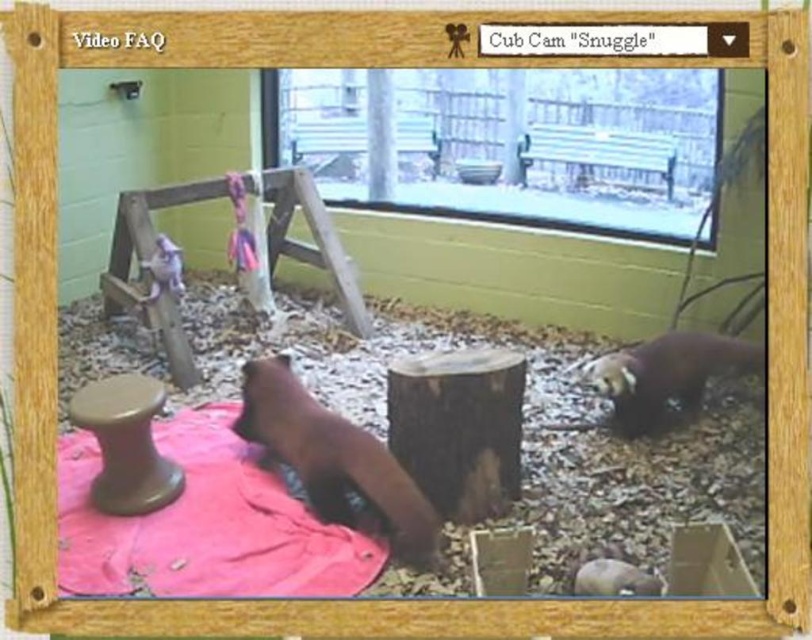
Is pink fabric at lower left bigger than brown furry bear at lower right?

Yes, pink fabric at lower left is bigger than brown furry bear at lower right.

Who is positioned more to the left, pink fabric at lower left or brown furry bear at lower right?

pink fabric at lower left

This screenshot has width=812, height=640. Find the location of `pink fabric at lower left`. pink fabric at lower left is located at coordinates (205, 524).

Based on the photo, who is higher up, pink fabric at lower left or matte brown stool at lower left?

matte brown stool at lower left is above.

Based on the photo, does pink fabric at lower left come in front of matte brown stool at lower left?

Yes, pink fabric at lower left is in front of matte brown stool at lower left.

Between point (309, 524) and point (140, 433), which one is positioned behind?

The point (140, 433) is more distant.

At what (x,y) coordinates should I click in order to perform the action: click on pink fabric at lower left. Please return your answer as a coordinate pair (x, y). Looking at the image, I should click on (205, 524).

Image resolution: width=812 pixels, height=640 pixels. Find the location of `pink fabric at lower left`. pink fabric at lower left is located at coordinates (205, 524).

Which of these two, pink fabric at lower left or brown furry animal at center, stands shorter?

pink fabric at lower left

I want to click on pink fabric at lower left, so click(205, 524).